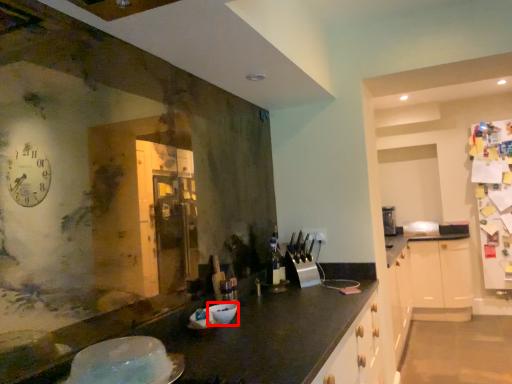
Question: In this image, where is bowl (annotated by the red box) located relative to appliance?

Choices:
 (A) left
 (B) right

Answer: (B)